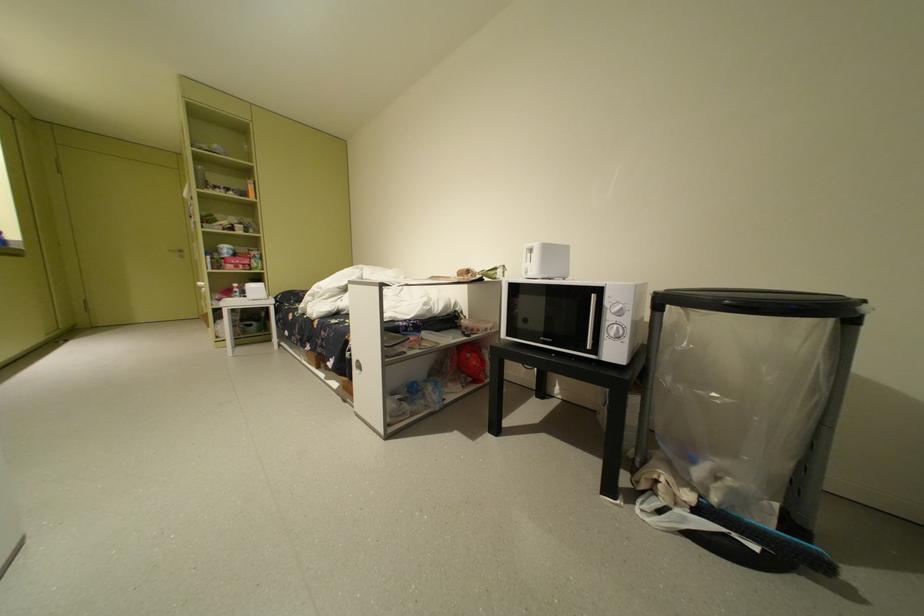
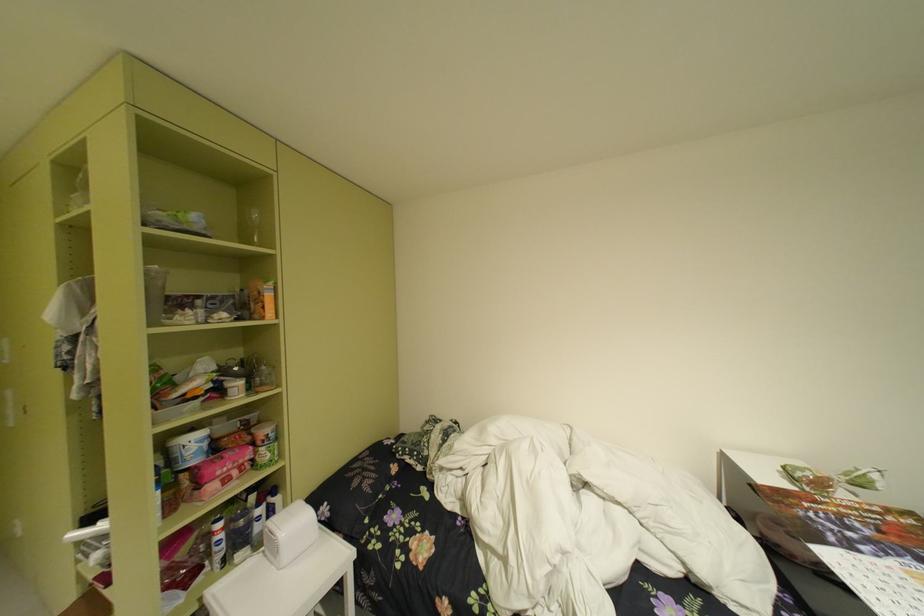
Find the pixel in the second image that matches point 249,288 in the first image.

(235, 528)